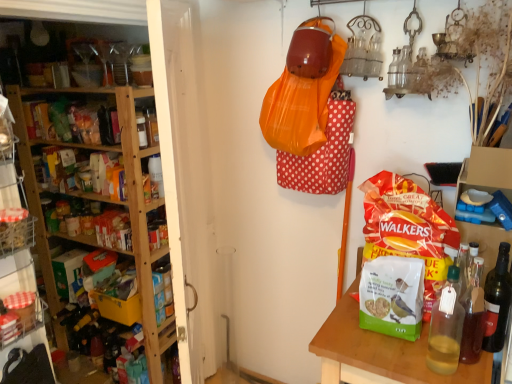
Question: Can you confirm if translucent glass bottle at right, which is the second bottle in left-to-right order, is shorter than wooden shelves at left?

Choices:
 (A) no
 (B) yes

Answer: (B)

Question: Is translucent glass bottle at right, the first bottle positioned from the right, at the right side of wooden shelves at left?

Choices:
 (A) yes
 (B) no

Answer: (A)

Question: From a real-world perspective, is translucent glass bottle at right, the first bottle positioned from the right, on top of wooden shelves at left?

Choices:
 (A) yes
 (B) no

Answer: (A)

Question: Is translucent glass bottle at right, which is the second bottle in left-to-right order, facing away from wooden shelves at left?

Choices:
 (A) yes
 (B) no

Answer: (B)

Question: Considering the relative sizes of translucent glass bottle at right, the first bottle positioned from the right, and wooden shelves at left in the image provided, is translucent glass bottle at right, the first bottle positioned from the right, wider than wooden shelves at left?

Choices:
 (A) yes
 (B) no

Answer: (B)

Question: Considering their positions, is translucent glass bottle at right, which is the second bottle in left-to-right order, located in front of or behind translucent glass bottle at right, marked as the 1th bottle in a left-to-right arrangement?

Choices:
 (A) behind
 (B) front

Answer: (A)

Question: Based on their positions, is translucent glass bottle at right, the first bottle positioned from the right, located to the left or right of translucent glass bottle at right, which is the second bottle in right-to-left order?

Choices:
 (A) right
 (B) left

Answer: (A)

Question: From the image's perspective, relative to translucent glass bottle at right, marked as the 1th bottle in a left-to-right arrangement, is translucent glass bottle at right, which is the second bottle in left-to-right order, above or below?

Choices:
 (A) above
 (B) below

Answer: (A)

Question: Looking at the image, does translucent glass bottle at right, which is the second bottle in left-to-right order, seem bigger or smaller compared to translucent glass bottle at right, which is the second bottle in right-to-left order?

Choices:
 (A) big
 (B) small

Answer: (B)

Question: In the image, is wooden table at lower right positioned in front of or behind translucent glass bottle at right, the first bottle positioned from the right?

Choices:
 (A) front
 (B) behind

Answer: (A)

Question: Does point (361, 340) appear closer or farther from the camera than point (506, 259)?

Choices:
 (A) farther
 (B) closer

Answer: (B)

Question: Choose the correct answer: Is wooden table at lower right inside translucent glass bottle at right, the first bottle positioned from the right, or outside it?

Choices:
 (A) inside
 (B) outside

Answer: (B)

Question: From a real-world perspective, is wooden table at lower right physically located above or below translucent glass bottle at right, which is the second bottle in left-to-right order?

Choices:
 (A) above
 (B) below

Answer: (B)

Question: Is wooden shelves at left taller or shorter than translucent glass bottle at right, which is the second bottle in right-to-left order?

Choices:
 (A) short
 (B) tall

Answer: (B)

Question: From the image's perspective, is wooden shelves at left located above or below translucent glass bottle at right, which is the second bottle in right-to-left order?

Choices:
 (A) above
 (B) below

Answer: (A)